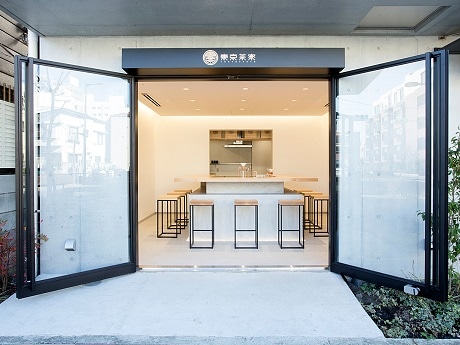
Identify the location of cooker hood. Image resolution: width=460 pixels, height=345 pixels. (236, 144).